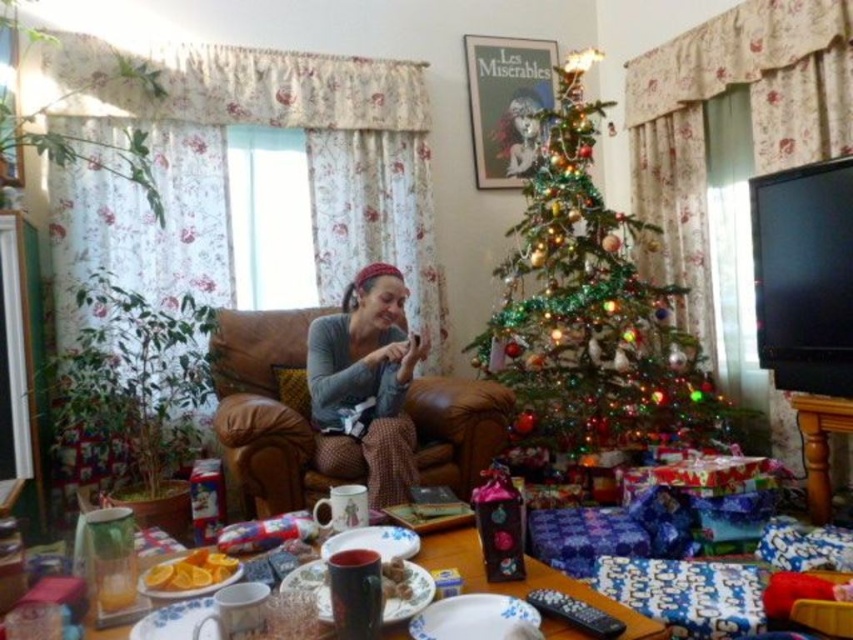
Question: Observing the image, what is the correct spatial positioning of brown leather couch at center in reference to gray knitted sweater at center?

Choices:
 (A) left
 (B) right

Answer: (A)

Question: In this image, where is brown leather couch at center located relative to gray knitted sweater at center?

Choices:
 (A) right
 (B) left

Answer: (B)

Question: Which point is closer to the camera taking this photo?

Choices:
 (A) (604, 392)
 (B) (322, 413)
 (C) (242, 477)

Answer: (C)

Question: Is green shiny christmas tree at center thinner than gray knitted sweater at center?

Choices:
 (A) yes
 (B) no

Answer: (B)

Question: Which object is closer to the camera taking this photo?

Choices:
 (A) brown leather couch at center
 (B) green shiny christmas tree at center
 (C) gray knitted sweater at center

Answer: (C)

Question: Which of the following is the closest to the observer?

Choices:
 (A) gray knitted sweater at center
 (B) brown leather couch at center

Answer: (A)